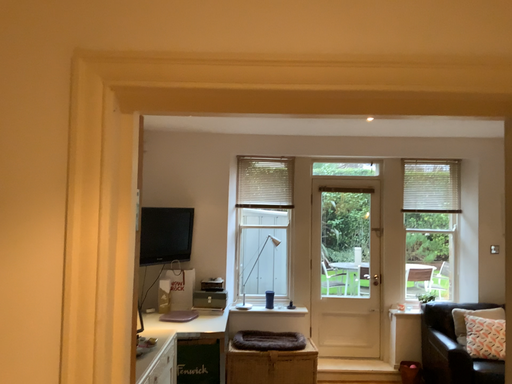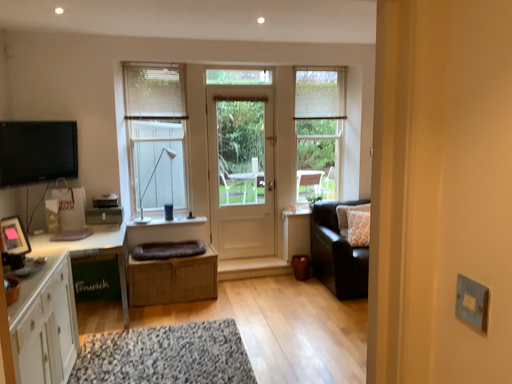
Question: Which way did the camera rotate in the video?

Choices:
 (A) rotated left
 (B) rotated right

Answer: (B)